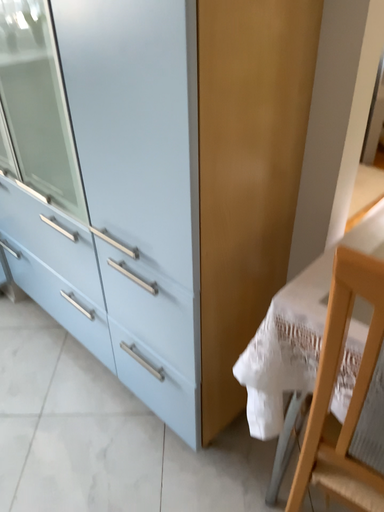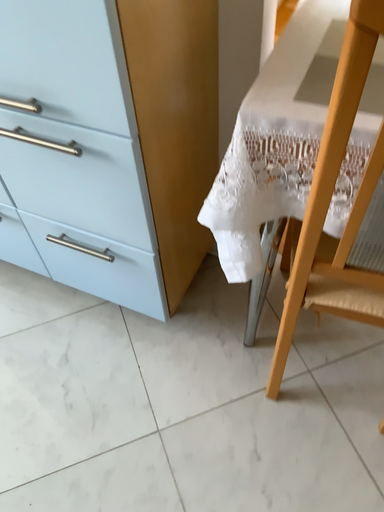
Question: Which way did the camera rotate in the video?

Choices:
 (A) rotated downward
 (B) rotated upward

Answer: (A)